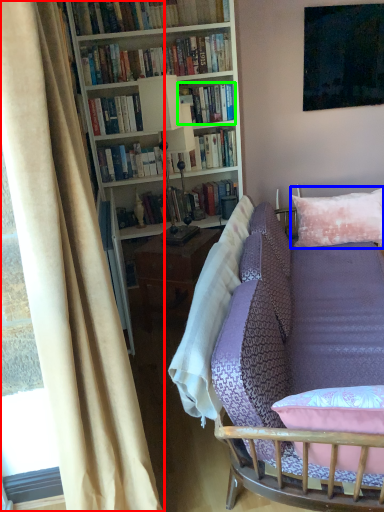
Question: Which object is the closest to the curtain (highlighted by a red box)? Choose among these: pillow (highlighted by a blue box) or book (highlighted by a green box).

Choices:
 (A) pillow
 (B) book

Answer: (A)